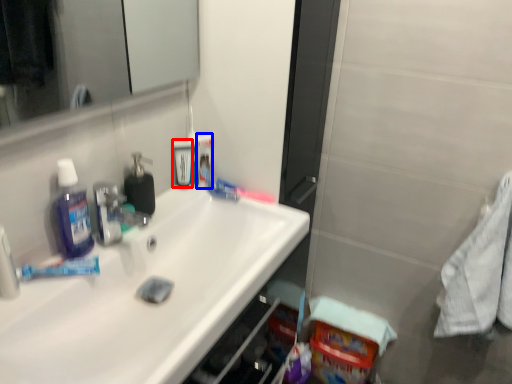
Question: Which of the following is the farthest to the observer, mouthwash (highlighted by a red box) or mouthwash (highlighted by a blue box)?

Choices:
 (A) mouthwash
 (B) mouthwash

Answer: (B)